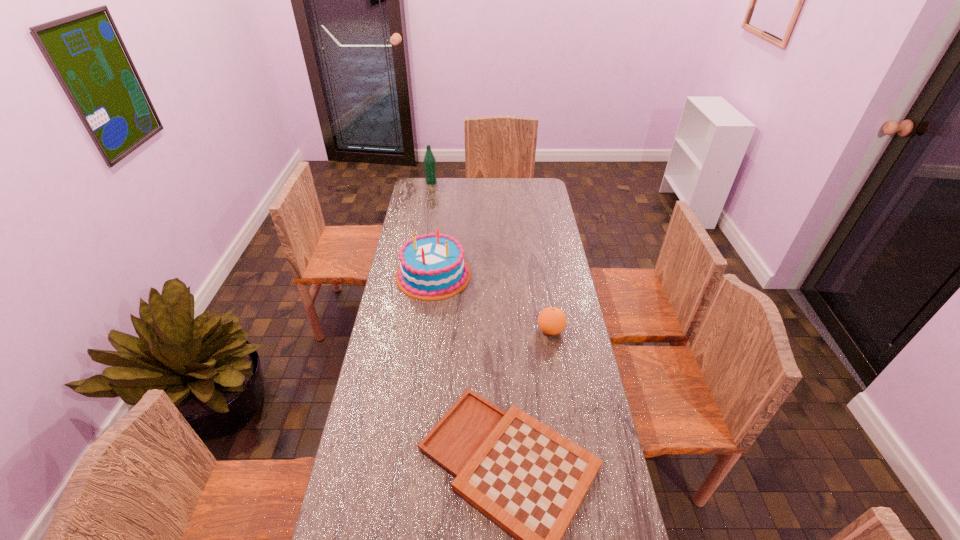
This screenshot has height=540, width=960. In order to click on free space between the bottle and the orange in this screenshot , I will do `click(491, 256)`.

In order to click on vacant space that's between the bottle and the third nearest object in this screenshot , I will do `click(432, 228)`.

Locate an element on the screen. the second closest object to the birthday cake is located at coordinates (530, 480).

Identify the location of the closest object relative to the nearest object. The height and width of the screenshot is (540, 960). (552, 321).